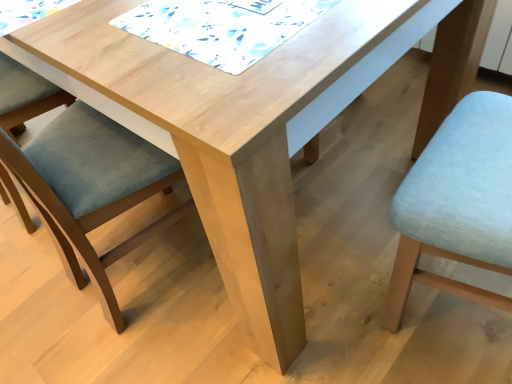
Question: From the image's perspective, is white printed fabric at upper center positioned above or below matte blue cushion at left, arranged as the first chair when viewed from the left?

Choices:
 (A) above
 (B) below

Answer: (A)

Question: Is white printed fabric at upper center wider or thinner than matte blue cushion at left, arranged as the first chair when viewed from the left?

Choices:
 (A) wide
 (B) thin

Answer: (B)

Question: Estimate the real-world distances between objects in this image. Which object is closer to the white printed fabric at upper center?

Choices:
 (A) matte blue cushion at left, arranged as the second chair when viewed from the right
 (B) light blue fabric chair at lower right, arranged as the second chair when viewed from the left

Answer: (A)

Question: Which object is positioned farthest from the light blue fabric chair at lower right, positioned as the first chair in right-to-left order?

Choices:
 (A) white printed fabric at upper center
 (B) matte blue cushion at left, arranged as the second chair when viewed from the right

Answer: (B)